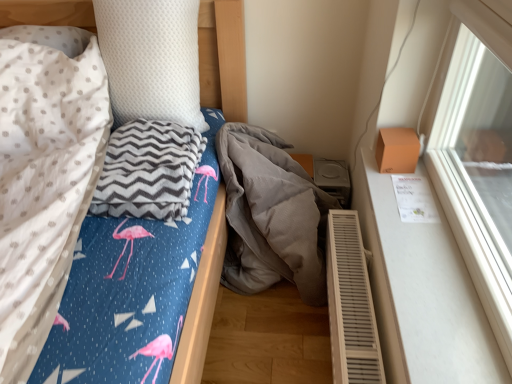
In order to click on vacant space situated above white matte window sill at right (from a real-world perspective) in this screenshot , I will do [416, 239].